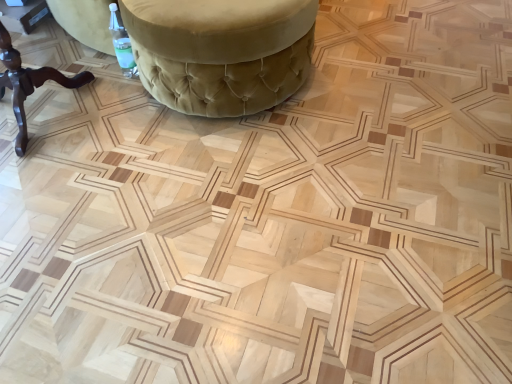
You are a GUI agent. You are given a task and a screenshot of the screen. Output one action in this format:
    pyautogui.click(x=<x>, y=<y>)
    Task: Click on the unoccupied region to the right of brown wooden table at left, the 1th furniture in the left-to-right sequence
    
    Given the screenshot: What is the action you would take?
    pyautogui.click(x=142, y=146)